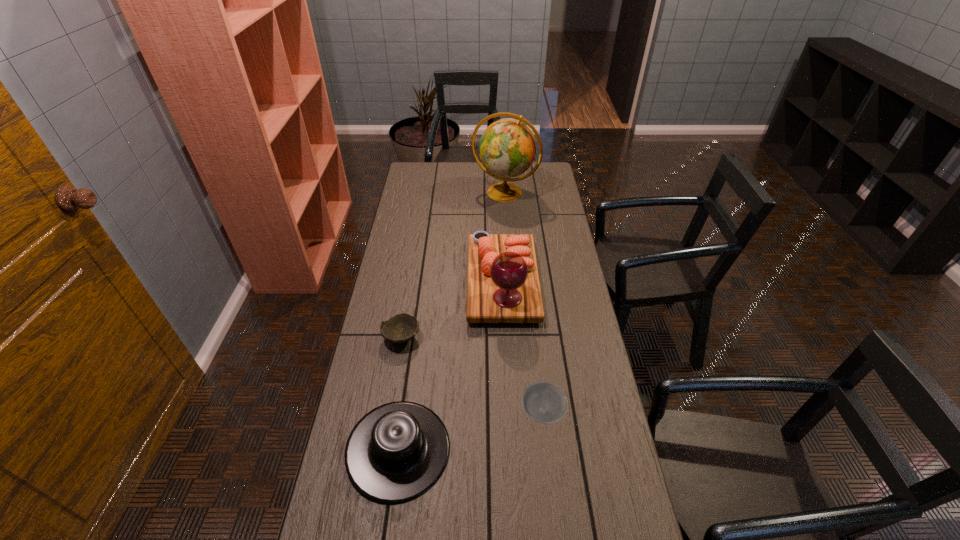
Identify the location of free region at the far left corner of the desktop. (433, 163).

The width and height of the screenshot is (960, 540). Identify the location of vacant space in between the right bowl and the farther bowl. (472, 375).

The width and height of the screenshot is (960, 540). Identify the location of free area in between the platter and the third tallest object. (450, 366).

Where is `free spot between the farther bowl and the fourth shortest object`? The image size is (960, 540). free spot between the farther bowl and the fourth shortest object is located at coordinates (452, 309).

In order to click on unoccupied position between the platter and the left bowl in this screenshot , I will do `click(452, 309)`.

Choose which object is the fourth nearest neighbor to the nearer bowl. Please provide its 2D coordinates. Your answer should be formatted as a tuple, i.e. [(x, y)], where the tuple contains the x and y coordinates of a point satisfying the conditions above.

[(507, 148)]

The width and height of the screenshot is (960, 540). In order to click on the fourth closest object relative to the third shortest object in this screenshot , I will do `click(507, 148)`.

Identify the location of free space that satisfies the following two spatial constraints: 1. on the back side of the tallest object; 2. on the left side of the third tallest object. The height and width of the screenshot is (540, 960). (434, 193).

Identify the location of vacant space that satisfies the following two spatial constraints: 1. on the back side of the dress hat; 2. on the left side of the platter. The width and height of the screenshot is (960, 540). (422, 281).

The width and height of the screenshot is (960, 540). In order to click on vacant space that satisfies the following two spatial constraints: 1. on the front side of the farthest object; 2. on the left side of the right bowl in this screenshot , I will do `click(521, 412)`.